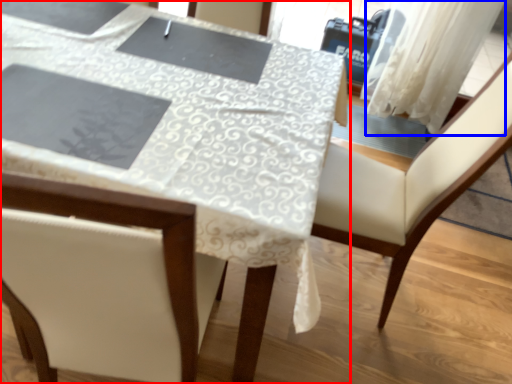
Question: Which object appears farthest to the camera in this image, table (highlighted by a red box) or curtain (highlighted by a blue box)?

Choices:
 (A) table
 (B) curtain

Answer: (B)